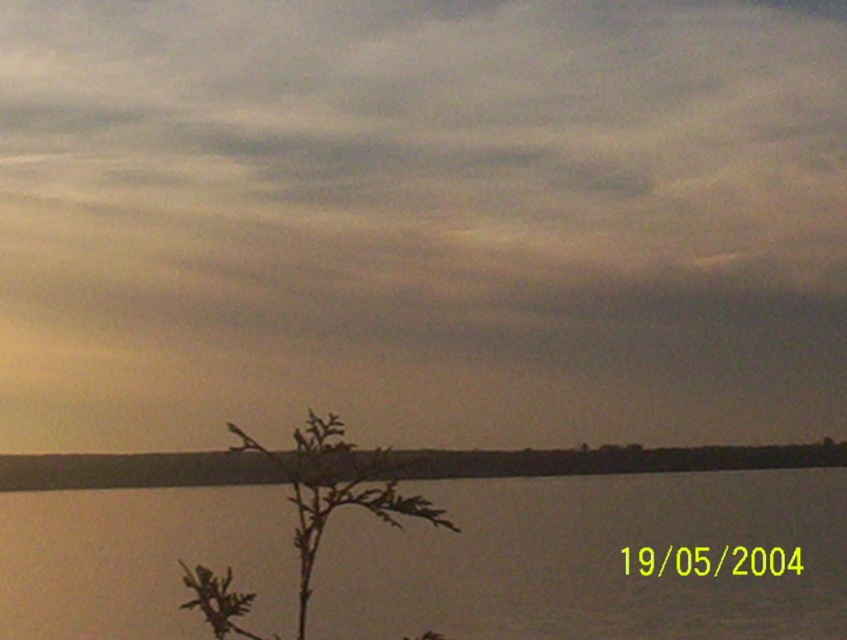
Question: Which point is closer to the camera?

Choices:
 (A) green leafy plant at lower left
 (B) gray matte cloud at upper center

Answer: (A)

Question: Does gray matte cloud at upper center appear under green leafy plant at lower left?

Choices:
 (A) no
 (B) yes

Answer: (A)

Question: Which object is the closest to the gray matte cloud at upper center?

Choices:
 (A) transparent water at bottom
 (B) green leafy plant at lower left

Answer: (A)

Question: Can you confirm if transparent water at bottom is positioned to the right of green leafy plant at lower left?

Choices:
 (A) no
 (B) yes

Answer: (B)

Question: Can you confirm if gray matte cloud at upper center is positioned to the right of green leafy plant at lower left?

Choices:
 (A) yes
 (B) no

Answer: (A)

Question: Which point is farther from the camera taking this photo?

Choices:
 (A) (237, 600)
 (B) (454, 93)

Answer: (B)